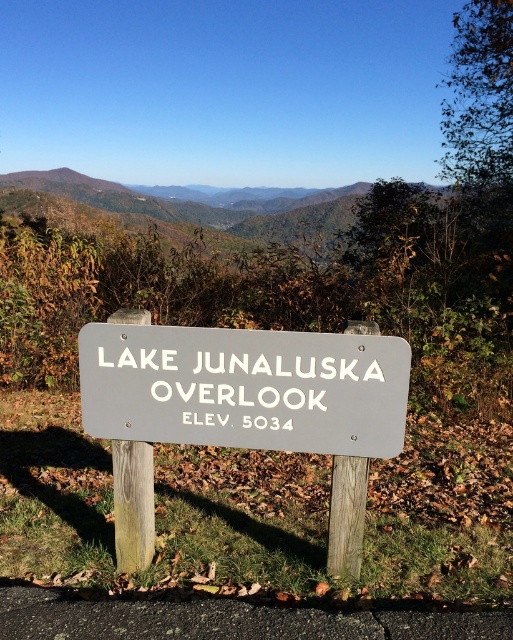
You are a photographer trying to capture the Lake Junaluska Overlook sign and the mountain in the background. Given that your camera can focus on objects within a 10 meter range, will both the gray wood sign at center and the green leafy mountain at upper center be in focus?

The gray wood sign at center and the green leafy mountain at upper center are 12.03 meters apart. Since the camera can only focus within a 10 meter range, the distance between them exceeds this limit, so both cannot be in focus simultaneously.

You are a photographer planning to capture the Lake Junaluska Overlook. You want to ensure the gray wood sign at center and the green leafy mountain at upper center are both visible in your shot. Considering their sizes, which object will appear larger in the photo?

The gray wood sign at center will appear larger in the photo because it has a greater height compared to the green leafy mountain at upper center.